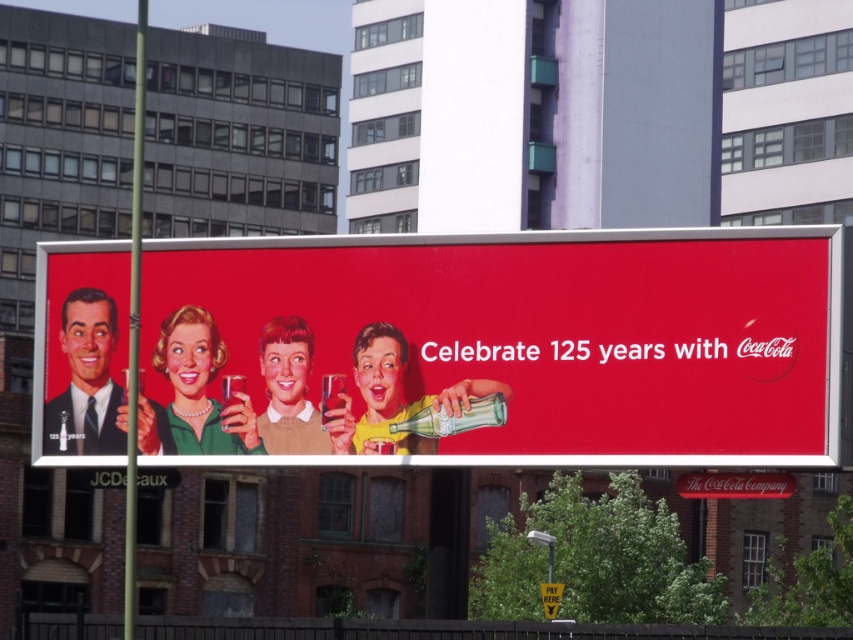
Does matte red billboard at center appear on the right side of matte plastic bottle at center?

Yes, matte red billboard at center is to the right of matte plastic bottle at center.

Does matte red billboard at center lie behind matte plastic bottle at center?

No, matte red billboard at center is closer to the viewer.

You are a GUI agent. You are given a task and a screenshot of the screen. Output one action in this format:
    pyautogui.click(x=<x>, y=<y>)
    Task: Click on the matte red billboard at center
    The height and width of the screenshot is (640, 853).
    Given the screenshot: What is the action you would take?
    pyautogui.click(x=495, y=346)

Locate an element on the screen. Image resolution: width=853 pixels, height=640 pixels. matte red billboard at center is located at coordinates (495, 346).

Who is taller, matte black suit at left or matte green dress at center?

matte black suit at left is taller.

Is point (90, 288) more distant than point (165, 344)?

Yes, it is.

Which is in front, point (109, 378) or point (223, 444)?

Point (223, 444) is more forward.

The image size is (853, 640). I want to click on matte black suit at left, so click(86, 380).

Is matte green dress at center positioned before smooth plastic cup at center?

No, matte green dress at center is further to the viewer.

From the picture: Is matte green dress at center further to the viewer compared to smooth plastic cup at center?

Yes.

Image resolution: width=853 pixels, height=640 pixels. What do you see at coordinates (202, 387) in the screenshot? I see `matte green dress at center` at bounding box center [202, 387].

Identify the location of matte green dress at center. This screenshot has width=853, height=640. (202, 387).